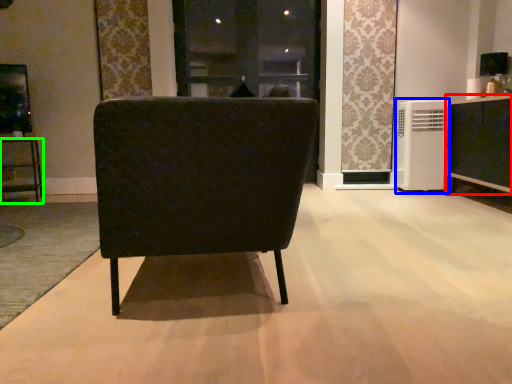
Question: Estimate the real-world distances between objects in this image. Which object is farther from cabinetry (highlighted by a red box), air conditioner (highlighted by a blue box) or furniture (highlighted by a green box)?

Choices:
 (A) air conditioner
 (B) furniture

Answer: (B)